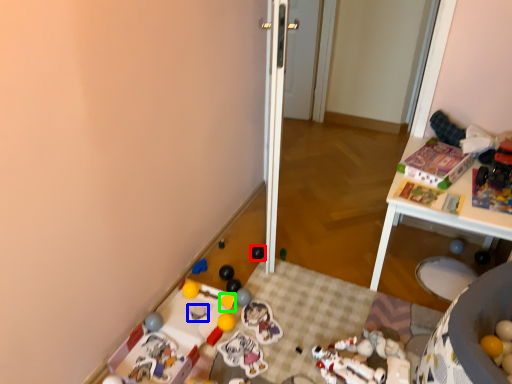
Question: Estimate the real-world distances between objects in this image. Which object is farther from toy (highlighted by a red box), toy (highlighted by a blue box) or toy (highlighted by a green box)?

Choices:
 (A) toy
 (B) toy

Answer: (A)